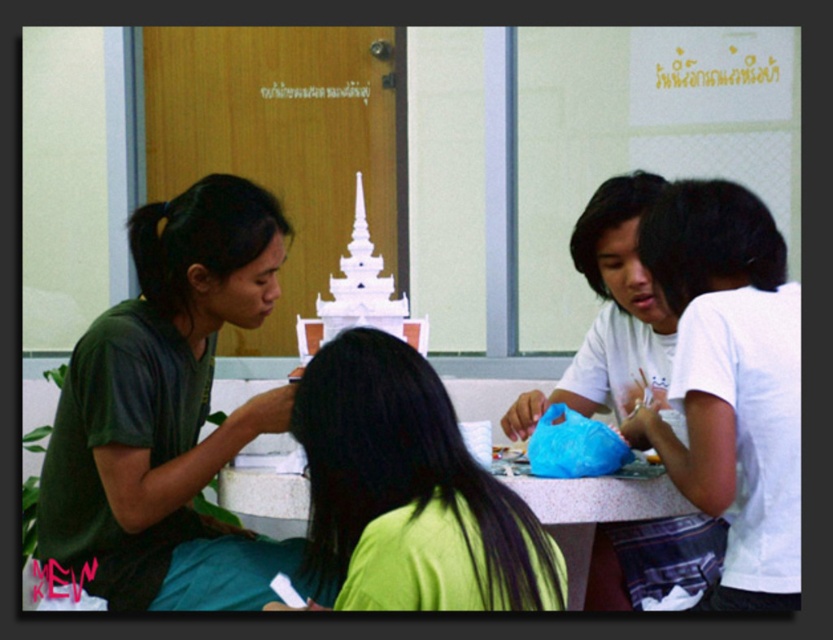
Can you confirm if dark green t-shirt at left is shorter than white cotton shirt at right?

Incorrect, dark green t-shirt at left's height does not fall short of white cotton shirt at right's.

Who is positioned more to the left, dark green t-shirt at left or white cotton shirt at right?

Answer: dark green t-shirt at left is more to the left.

Between point (240, 440) and point (759, 444), which one is positioned in front?

Point (759, 444)

Where is `dark green t-shirt at left`? This screenshot has width=833, height=640. dark green t-shirt at left is located at coordinates (168, 412).

Which of these two, white cotton shirt at right or green matte shirt at center, stands shorter?

green matte shirt at center

Between point (701, 269) and point (521, 524), which one is positioned in front?

Point (521, 524) is more forward.

Locate an element on the screen. The width and height of the screenshot is (833, 640). white cotton shirt at right is located at coordinates [731, 381].

Does dark green t-shirt at left have a lesser height compared to green matte shirt at center?

No, dark green t-shirt at left is not shorter than green matte shirt at center.

Can you confirm if dark green t-shirt at left is thinner than green matte shirt at center?

Incorrect, dark green t-shirt at left's width is not less than green matte shirt at center's.

Is point (138, 328) more distant than point (536, 596)?

Yes, point (138, 328) is behind point (536, 596).

This screenshot has width=833, height=640. I want to click on dark green t-shirt at left, so click(168, 412).